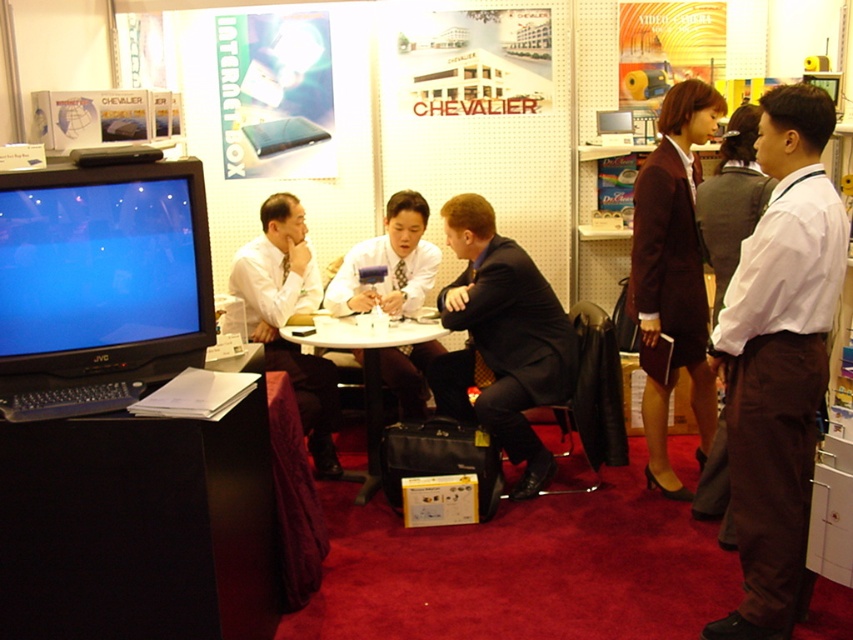
Question: Which of the following is the farthest from the observer?

Choices:
 (A) (22, 374)
 (B) (682, 252)

Answer: (B)

Question: Is white shirt at center positioned behind maroon fabric dress at right?

Choices:
 (A) no
 (B) yes

Answer: (A)

Question: Which of the following is the farthest from the observer?

Choices:
 (A) white shirt at center
 (B) white glossy tie at center
 (C) matte white shirt at center

Answer: (C)

Question: Can you confirm if white shirt at center is positioned to the left of black suit at center?

Choices:
 (A) yes
 (B) no

Answer: (B)

Question: Which object is closer to the camera taking this photo?

Choices:
 (A) black glossy monitor at left
 (B) black suit at center
 (C) maroon fabric dress at right
 (D) white glossy tie at center

Answer: (A)

Question: Is black suit at center below white glossy tie at center?

Choices:
 (A) no
 (B) yes

Answer: (B)